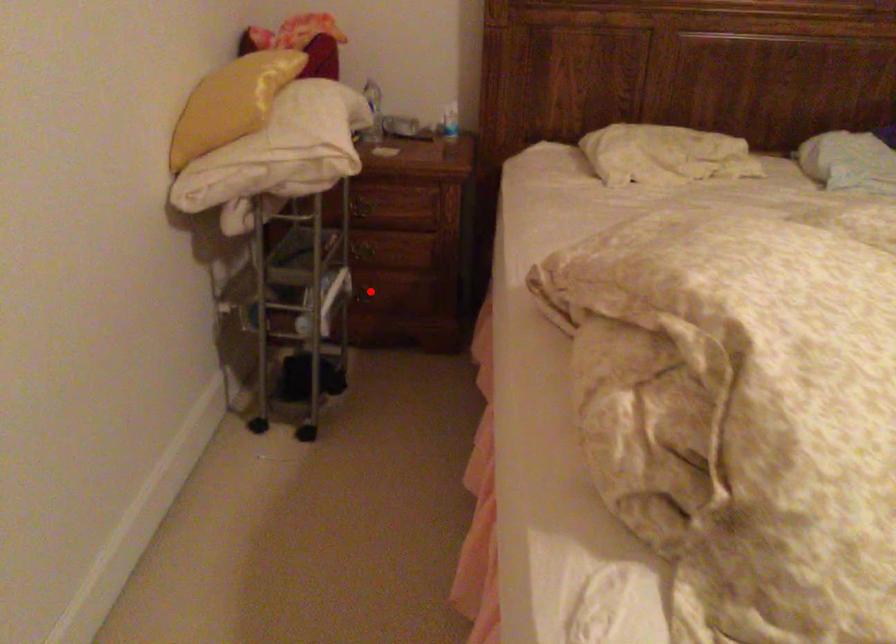
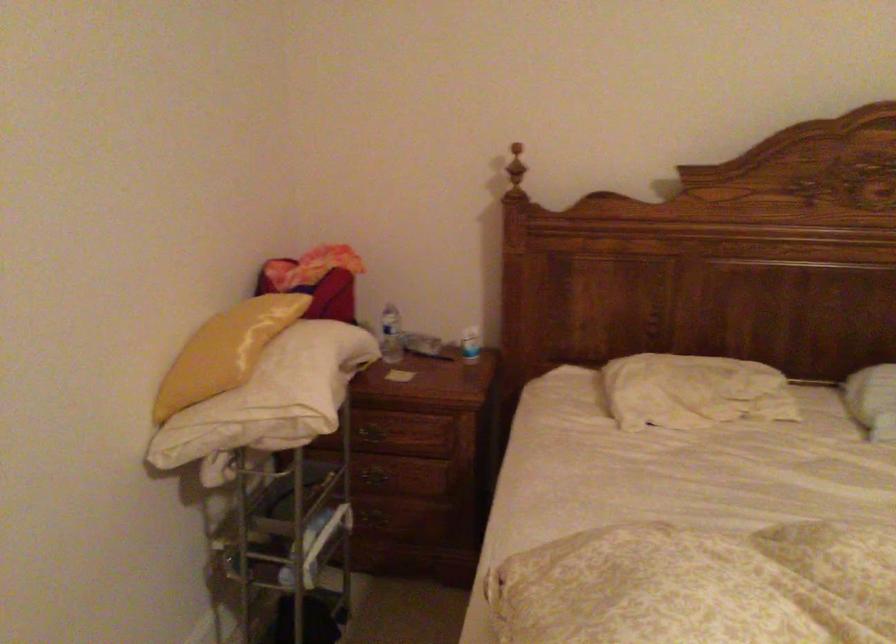
Locate, in the second image, the point that corresponds to the highlighted location in the first image.

(381, 516)